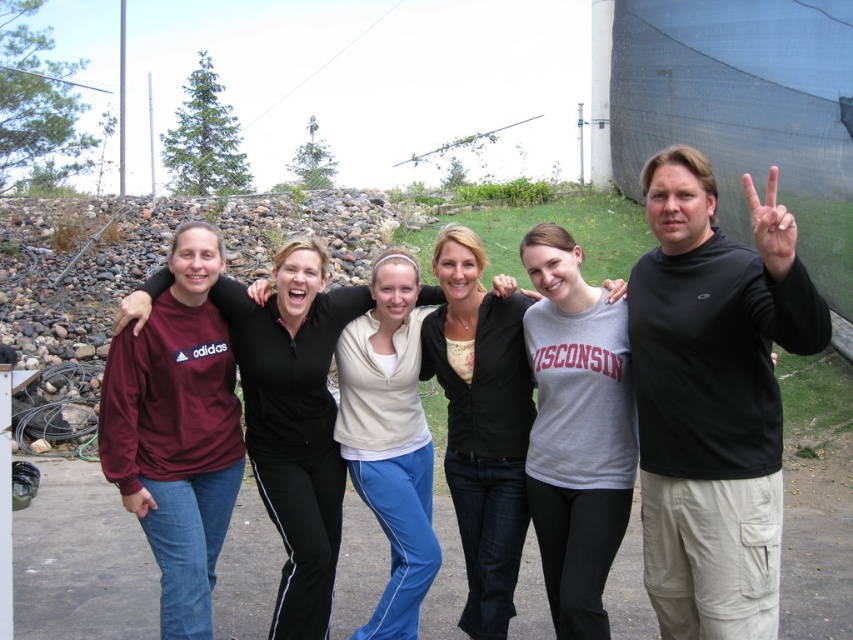
You are a photographer trying to adjust the group photo so that all clothing items are visible. Given that the maroon fleece at left and the gray cotton hoodie at center are two items of clothing in the photo, which clothing item should you move closer to the camera to ensure its full visibility if one is wider than the other?

The maroon fleece at left is wider than the gray cotton hoodie at center, so you should move the gray cotton hoodie at center closer to the camera to ensure its full visibility.

Consider the image. You are a photographer taking a group photo. You notice the black turtleneck shirt at center and the maroon fleece at left. Which clothing item is positioned closer to the camera?

The black turtleneck shirt at center is closer to the viewer than the maroon fleece at left, so it is positioned closer to the camera.

You are a photographer taking a picture of the group. You want to ensure that the black turtleneck shirt at center and the maroon fleece at left are both in focus. Which one is positioned closer to the camera so you can adjust your focus accordingly?

The maroon fleece at left is closer to the camera than the black turtleneck shirt at center because the black turtleneck shirt at center is to the right of maroon fleece at left.